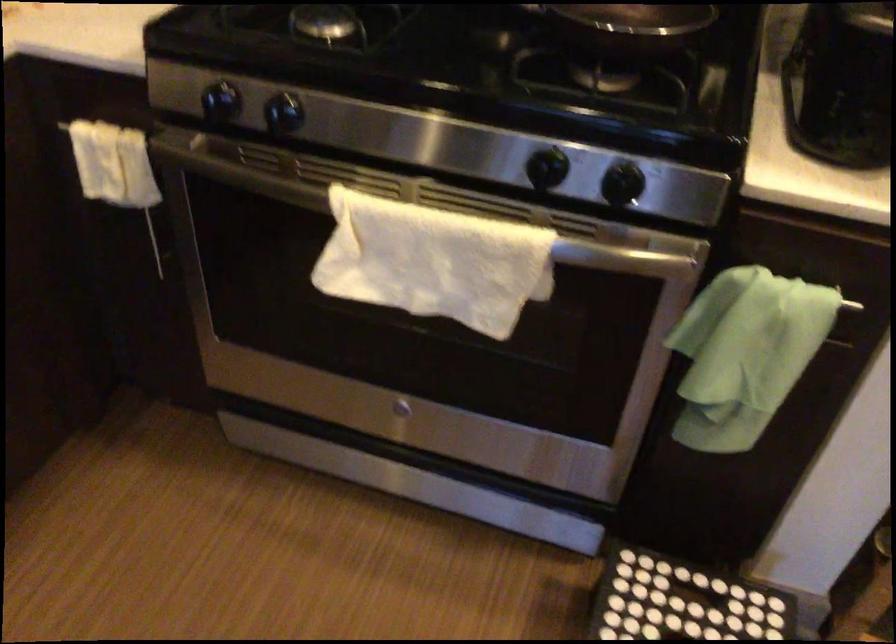
Find where to lift the black step stool. Please return your answer as a coordinate pair (x, y).

(693, 601)